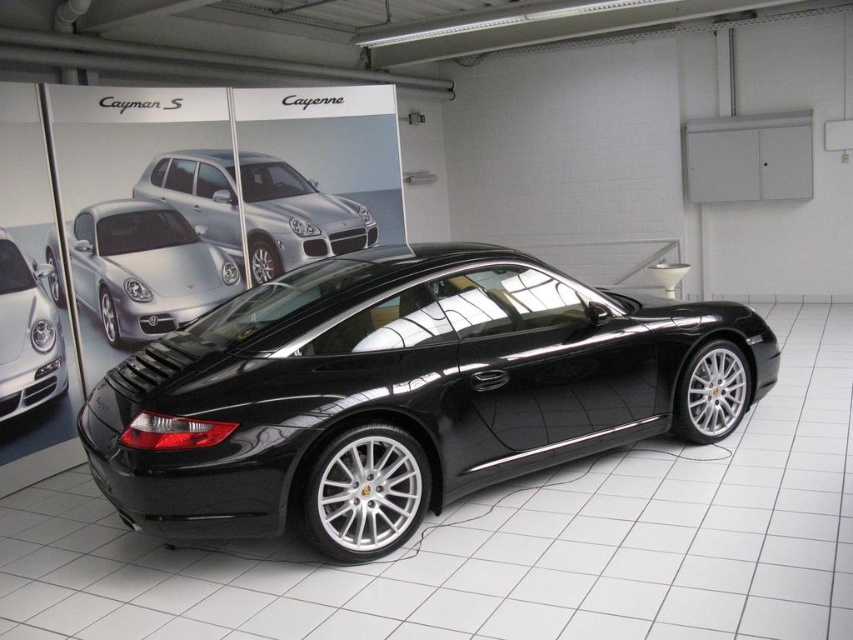
Who is lower down, satin silver suv at center or satin silver headlight at center?

satin silver headlight at center

Can you confirm if satin silver suv at center is positioned to the right of satin silver headlight at center?

Correct, you'll find satin silver suv at center to the right of satin silver headlight at center.

Locate an element on the screen. satin silver suv at center is located at coordinates (294, 218).

Between point (134, 307) and point (26, 401), which one is positioned in front?

Point (26, 401) is more forward.

Between shiny silver sedan at center and satin silver headlight at center, which one is positioned higher?

Positioned higher is shiny silver sedan at center.

This screenshot has width=853, height=640. What do you see at coordinates (144, 269) in the screenshot?
I see `shiny silver sedan at center` at bounding box center [144, 269].

This screenshot has width=853, height=640. Find the location of `shiny silver sedan at center`. shiny silver sedan at center is located at coordinates (144, 269).

Does glossy black sports car at center appear under shiny silver sedan at center?

Correct, glossy black sports car at center is located below shiny silver sedan at center.

Is glossy black sports car at center further to the viewer compared to shiny silver sedan at center?

No, it is not.

This screenshot has height=640, width=853. I want to click on glossy black sports car at center, so click(x=403, y=390).

This screenshot has width=853, height=640. Find the location of `glossy black sports car at center`. glossy black sports car at center is located at coordinates (403, 390).